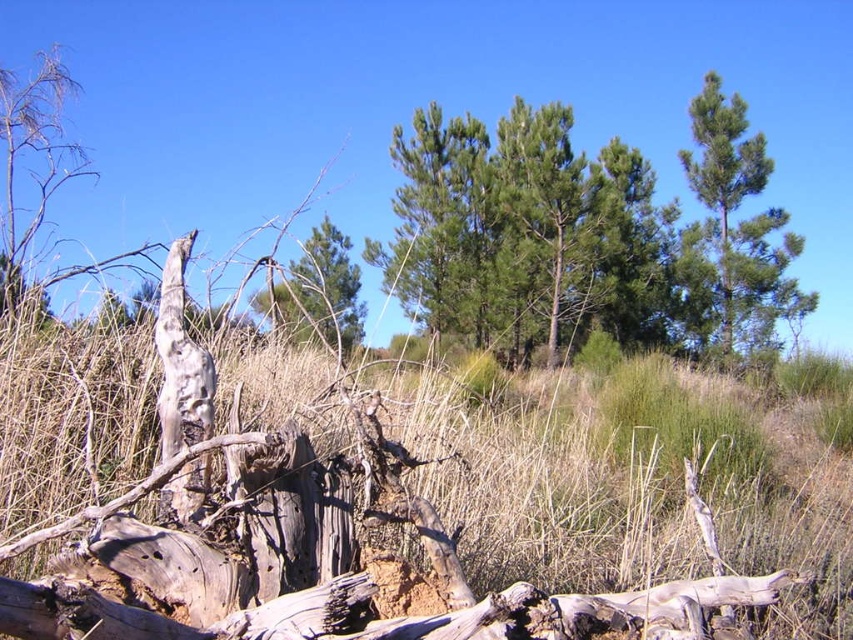
Question: Is green needle-like at upper right smaller than green leafy tree at center?

Choices:
 (A) yes
 (B) no

Answer: (A)

Question: In this image, where is green needle-like at center located relative to green needle-like at upper right?

Choices:
 (A) below
 (B) above

Answer: (A)

Question: Which is nearer to the green needle-like at upper right?

Choices:
 (A) green leafy tree at center
 (B) green needle-like at center

Answer: (B)

Question: Which point is closer to the camera?

Choices:
 (A) (479, 308)
 (B) (720, 168)
 (C) (260, 307)

Answer: (C)

Question: Where is green needle-like at center located in relation to green needle-like at upper right in the image?

Choices:
 (A) left
 (B) right

Answer: (A)

Question: Which point is closer to the camera?

Choices:
 (A) green leafy tree at center
 (B) green needle-like at center

Answer: (A)